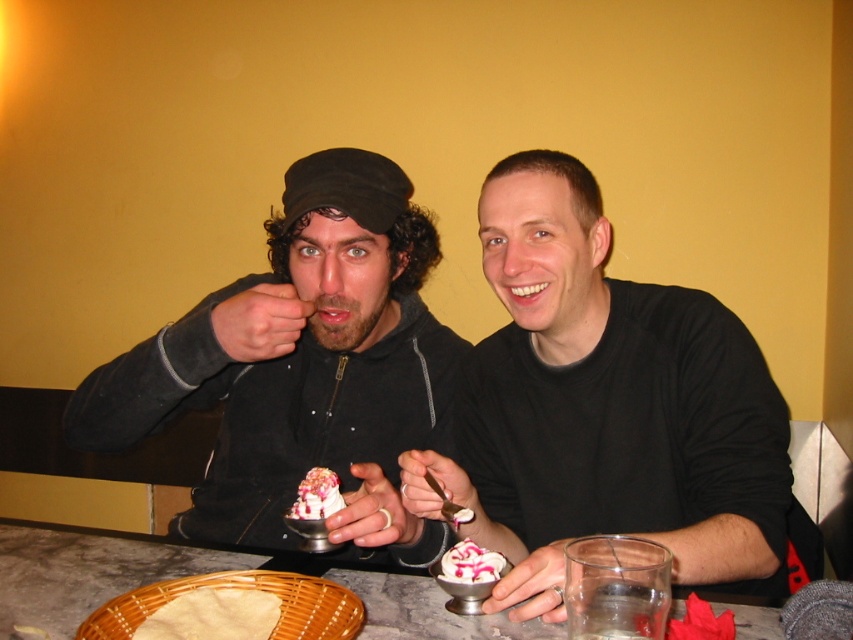
Question: Which of the following is the farthest from the observer?

Choices:
 (A) (456, 580)
 (B) (593, 433)
 (C) (265, 320)

Answer: (B)

Question: Considering the relative positions of matte yellow bread at lower left and whipped cream at center in the image provided, where is matte yellow bread at lower left located with respect to whipped cream at center?

Choices:
 (A) left
 (B) right

Answer: (A)

Question: Can you confirm if marble table at center is bigger than whipped cream at center?

Choices:
 (A) no
 (B) yes

Answer: (B)

Question: Which of the following is the closest to the observer?

Choices:
 (A) matte black jacket at center
 (B) matte yellow bread at lower left
 (C) white creamy dessert at center
 (D) black matte shirt at center

Answer: (B)

Question: From the image, what is the correct spatial relationship of whipped cream at center in relation to white creamy dessert at center?

Choices:
 (A) above
 (B) below

Answer: (B)

Question: Estimate the real-world distances between objects in this image. Which object is farther from the matte black jacket at center?

Choices:
 (A) matte yellow bread at lower left
 (B) black matte shirt at center

Answer: (A)